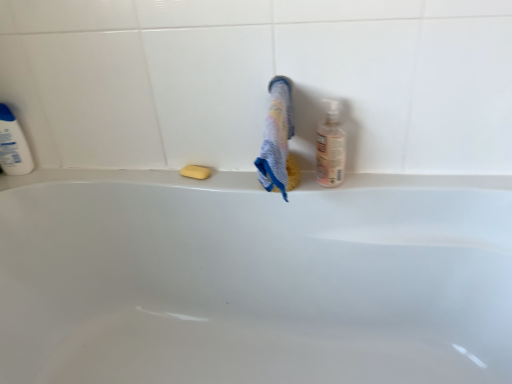
Question: From the image's perspective, is translucent plastic bottle at right, arranged as the 2th cleaning product when viewed from the back, above or below white plastic bottle at left, the 2th cleaning product in the front-to-back sequence?

Choices:
 (A) below
 (B) above

Answer: (A)

Question: Is translucent plastic bottle at right, the 1th cleaning product viewed from the right, inside or outside of white plastic bottle at left, the first cleaning product positioned from the back?

Choices:
 (A) outside
 (B) inside

Answer: (A)

Question: Considering the real-world distances, which object is closest to the white plastic bottle at left, the first cleaning product viewed from the left?

Choices:
 (A) multicolored textured towel at center
 (B) translucent plastic bottle at right, arranged as the 2th cleaning product when viewed from the back
 (C) yellow matte soap at center
 (D) white glossy bathtub at center

Answer: (C)

Question: Based on their relative distances, which object is nearer to the translucent plastic bottle at right, the 1th cleaning product viewed from the right?

Choices:
 (A) yellow matte soap at center
 (B) white plastic bottle at left, the 2th cleaning product in the front-to-back sequence
 (C) white glossy bathtub at center
 (D) multicolored textured towel at center

Answer: (D)